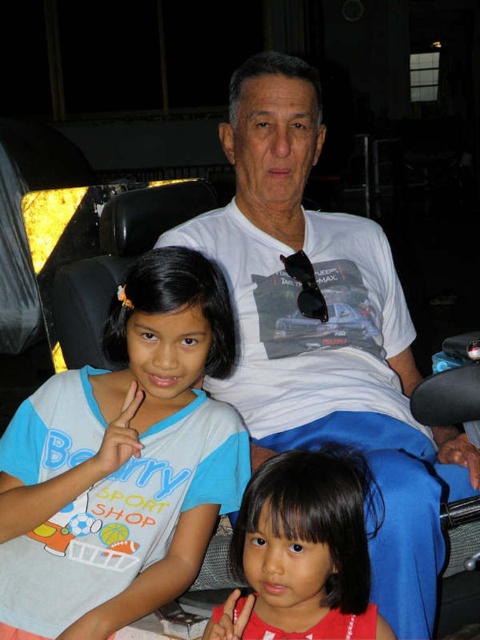
You are a tailor measuring shirts for alterations. You have a customer who wants to know which shirt is wider between the blue cotton shirt at left and the smooth red shirt at lower center. Which one should you recommend?

The blue cotton shirt at left is wider than the smooth red shirt at lower center, so you should recommend the blue cotton shirt at left if the customer prefers a wider fit.